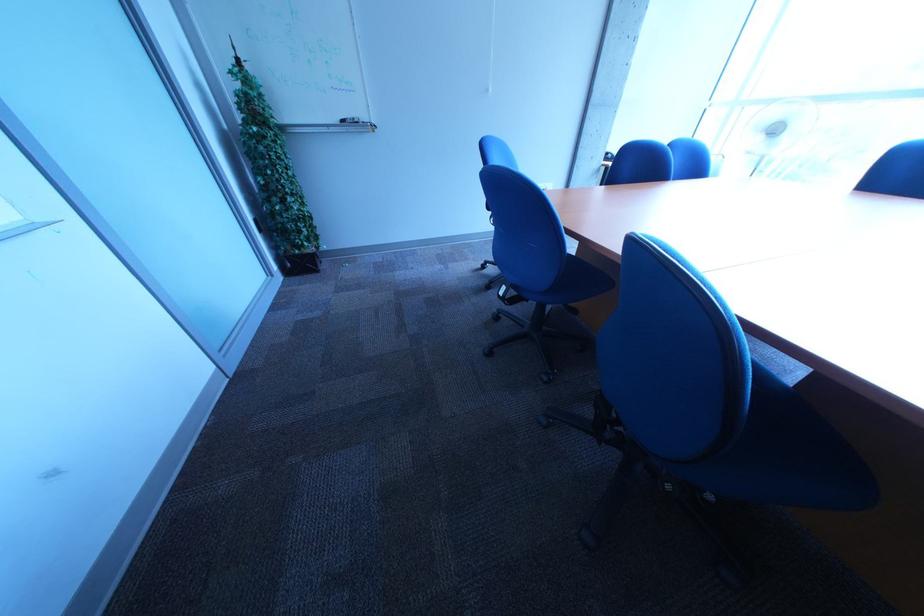
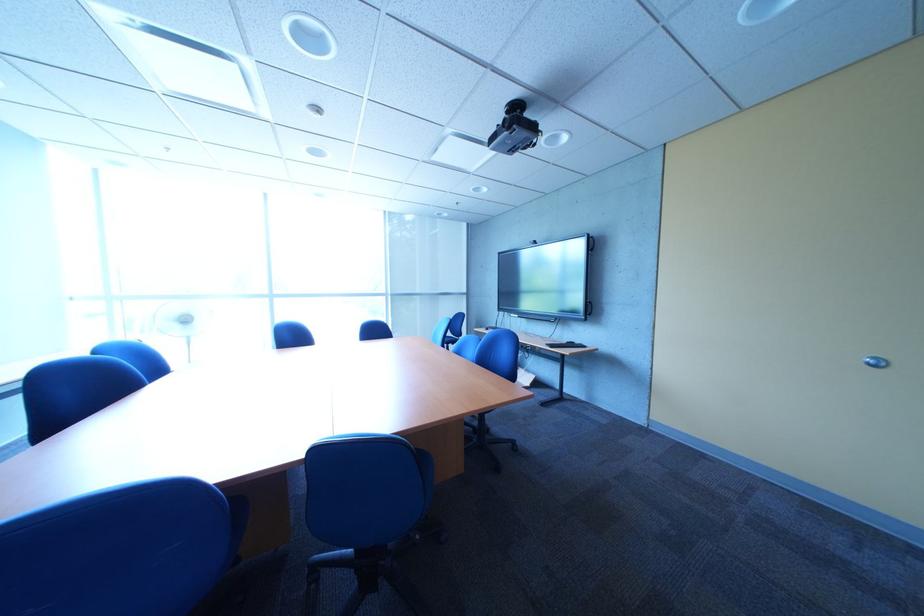
Question: The camera is either moving clockwise (left) or counter-clockwise (right) around the object. The first image is from the beginning of the video and the second image is from the end. Is the camera moving left or right when shooting the video?

Choices:
 (A) Left
 (B) Right

Answer: (A)